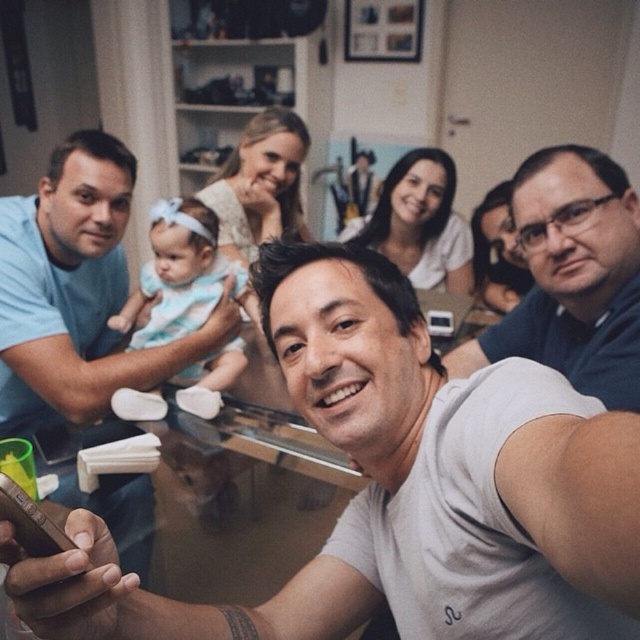
Question: Can you confirm if light blue fabric baby at left is positioned below light blue fabric baby at center?

Choices:
 (A) no
 (B) yes

Answer: (A)

Question: Is dark blue shirt at right to the right of light blue fabric baby at center from the viewer's perspective?

Choices:
 (A) no
 (B) yes

Answer: (B)

Question: Is light blue fabric baby at left wider than dark blue shirt at right?

Choices:
 (A) yes
 (B) no

Answer: (A)

Question: Which point is farther from the camera taking this photo?

Choices:
 (A) (13, 387)
 (B) (557, 248)
 (C) (218, 374)

Answer: (C)

Question: Which object appears farthest from the camera in this image?

Choices:
 (A) light blue fabric baby at left
 (B) dark blue shirt at right

Answer: (A)

Question: Which object is the closest to the light blue fabric baby at left?

Choices:
 (A) light blue fabric baby at center
 (B) dark blue shirt at right

Answer: (A)